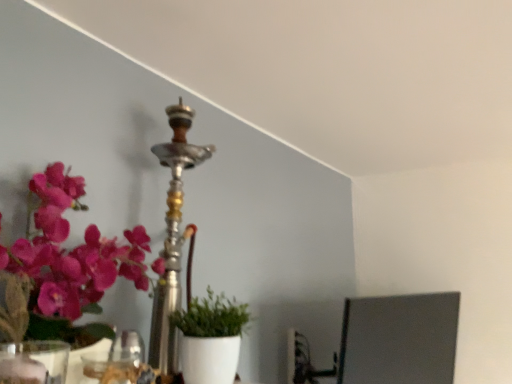
Question: From the image's perspective, would you say transparent glass vase at lower left is shown under green matte plant at center?

Choices:
 (A) no
 (B) yes

Answer: (A)

Question: Is transparent glass vase at lower left outside of green matte plant at center?

Choices:
 (A) yes
 (B) no

Answer: (A)

Question: From a real-world perspective, is transparent glass vase at lower left under green matte plant at center?

Choices:
 (A) no
 (B) yes

Answer: (B)

Question: Can you confirm if transparent glass vase at lower left is bigger than green matte plant at center?

Choices:
 (A) no
 (B) yes

Answer: (A)

Question: Can you confirm if transparent glass vase at lower left is taller than green matte plant at center?

Choices:
 (A) no
 (B) yes

Answer: (A)

Question: Considering the relative positions of metallic pink flowers at left and transparent glass vase at lower left in the image provided, is metallic pink flowers at left to the left or to the right of transparent glass vase at lower left?

Choices:
 (A) left
 (B) right

Answer: (A)

Question: Is metallic pink flowers at left wider or thinner than transparent glass vase at lower left?

Choices:
 (A) wide
 (B) thin

Answer: (A)

Question: Is metallic pink flowers at left situated inside transparent glass vase at lower left or outside?

Choices:
 (A) outside
 (B) inside

Answer: (A)

Question: In the image, is metallic pink flowers at left positioned in front of or behind transparent glass vase at lower left?

Choices:
 (A) behind
 (B) front

Answer: (A)

Question: In the image, is green matte plant at center positioned in front of or behind metallic pink flowers at left?

Choices:
 (A) front
 (B) behind

Answer: (B)

Question: Considering the positions of green matte plant at center and metallic pink flowers at left in the image, is green matte plant at center bigger or smaller than metallic pink flowers at left?

Choices:
 (A) small
 (B) big

Answer: (A)

Question: Considering the positions of green matte plant at center and metallic pink flowers at left in the image, is green matte plant at center wider or thinner than metallic pink flowers at left?

Choices:
 (A) thin
 (B) wide

Answer: (A)

Question: Does point (219, 304) appear closer or farther from the camera than point (49, 241)?

Choices:
 (A) closer
 (B) farther

Answer: (B)

Question: Does point coord(14,357) appear closer or farther from the camera than point coord(54,288)?

Choices:
 (A) farther
 (B) closer

Answer: (B)

Question: Would you say transparent glass vase at lower left is inside or outside metallic pink flowers at left?

Choices:
 (A) outside
 (B) inside

Answer: (A)